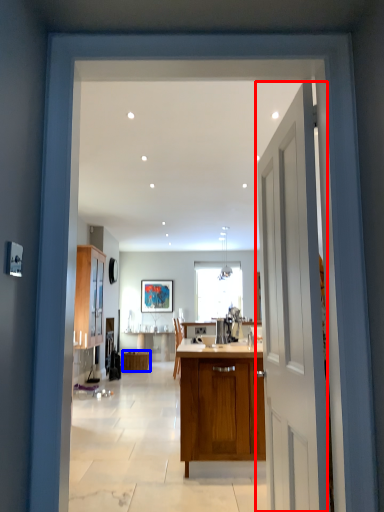
Question: Which point is closer to the camera, door (highlighted by a red box) or cabinetry (highlighted by a blue box)?

Choices:
 (A) door
 (B) cabinetry

Answer: (A)